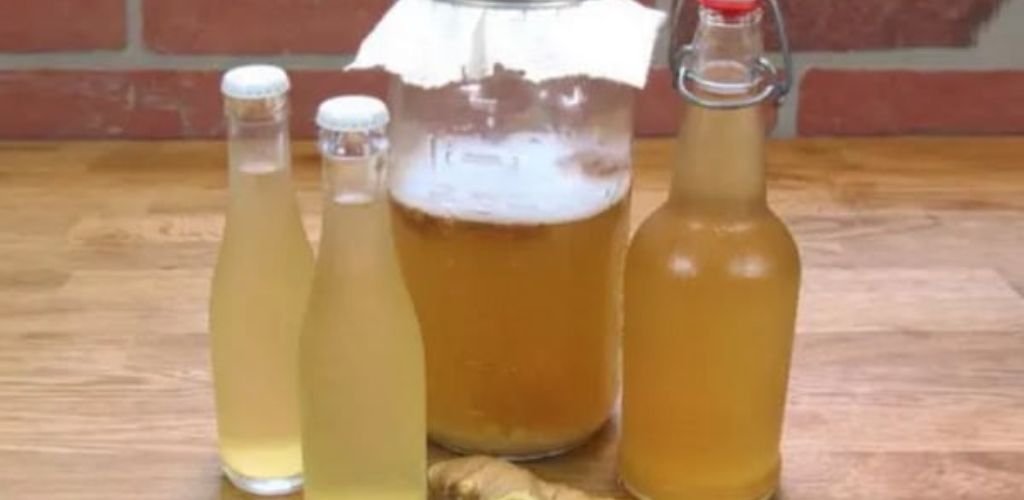
Where is `smaller bottles`? This screenshot has height=500, width=1024. smaller bottles is located at coordinates (252, 299), (348, 354).